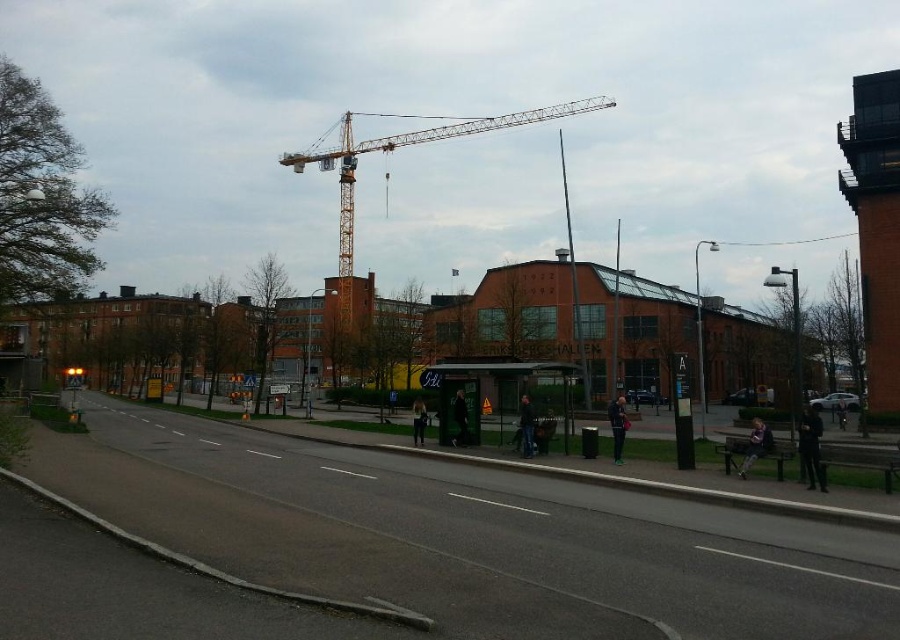
Question: Does dark blue denim jacket at lower right have a smaller size compared to light brown leather jacket at center?

Choices:
 (A) yes
 (B) no

Answer: (B)

Question: Is matte concrete sidewalk at lower center thinner than dark green jacket at center?

Choices:
 (A) no
 (B) yes

Answer: (A)

Question: Estimate the real-world distances between objects in this image. Which object is farther from the yellow metallic crane at upper center?

Choices:
 (A) dark green jacket at center
 (B) dark blue jacket at center
 (C) light brown leather jacket at center

Answer: (C)

Question: Among these objects, which one is nearest to the camera?

Choices:
 (A) light brown leather jacket at center
 (B) transparent plastic bus stop at center
 (C) yellow metallic crane at upper center

Answer: (B)

Question: Which point is closer to the camera taking this photo?

Choices:
 (A) (738, 467)
 (B) (817, 468)

Answer: (B)

Question: Can you confirm if yellow metallic crane at upper center is positioned below dark blue denim jacket at lower right?

Choices:
 (A) yes
 (B) no

Answer: (B)